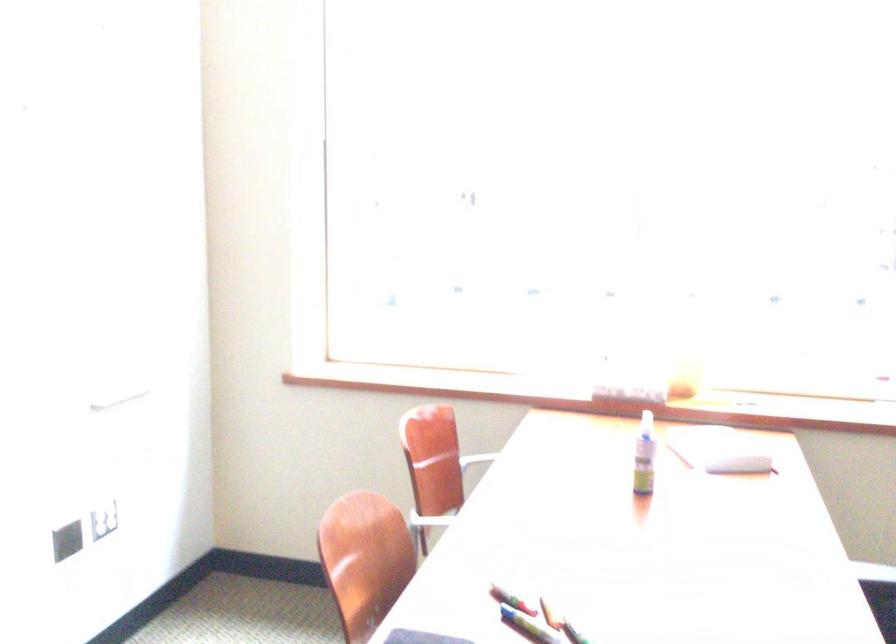
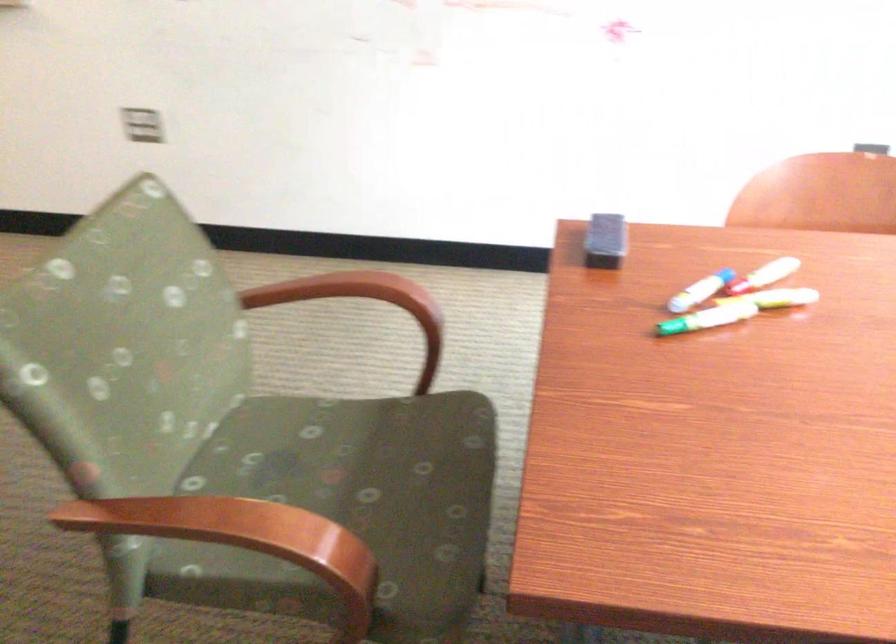
In the second image, find the point that corresponds to (122,518) in the first image.

(871, 147)